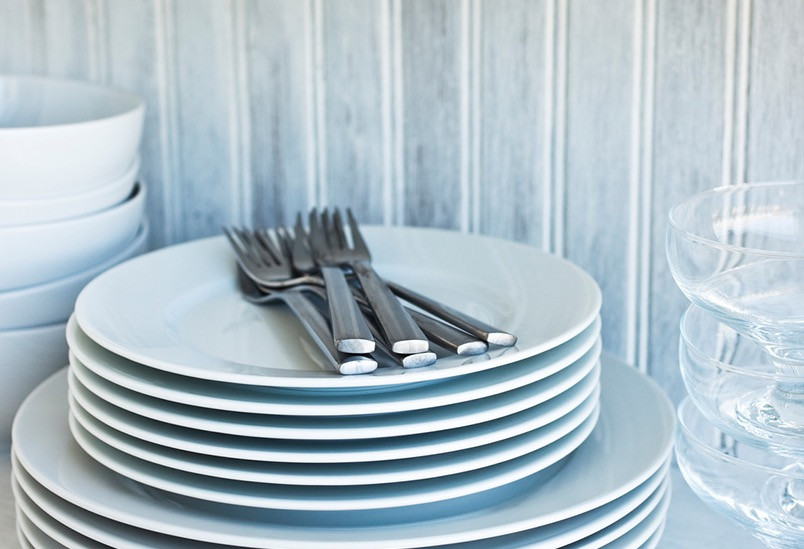
Locate an element on the screen. The height and width of the screenshot is (549, 804). small plate edges is located at coordinates (444, 495), (424, 477), (437, 447), (416, 433), (425, 404), (351, 386).